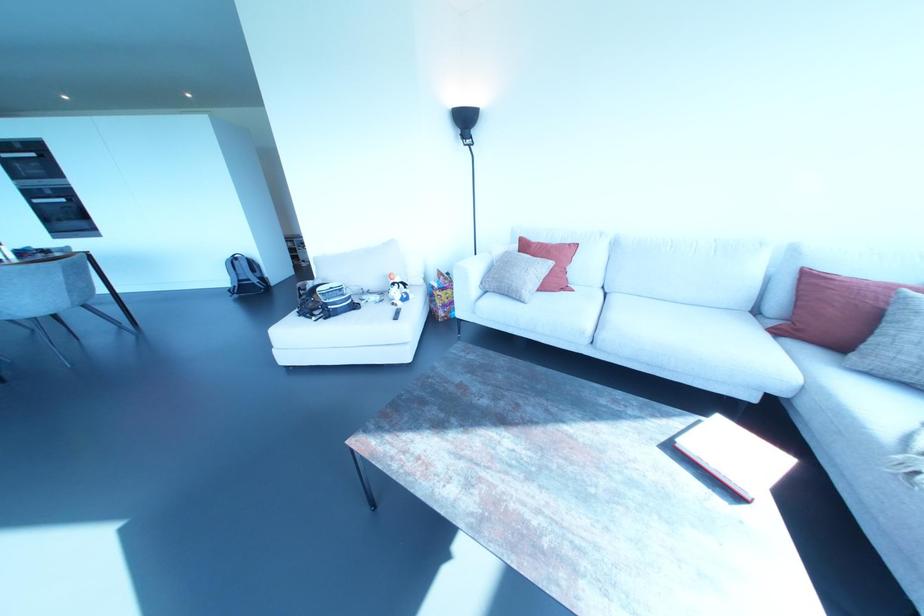
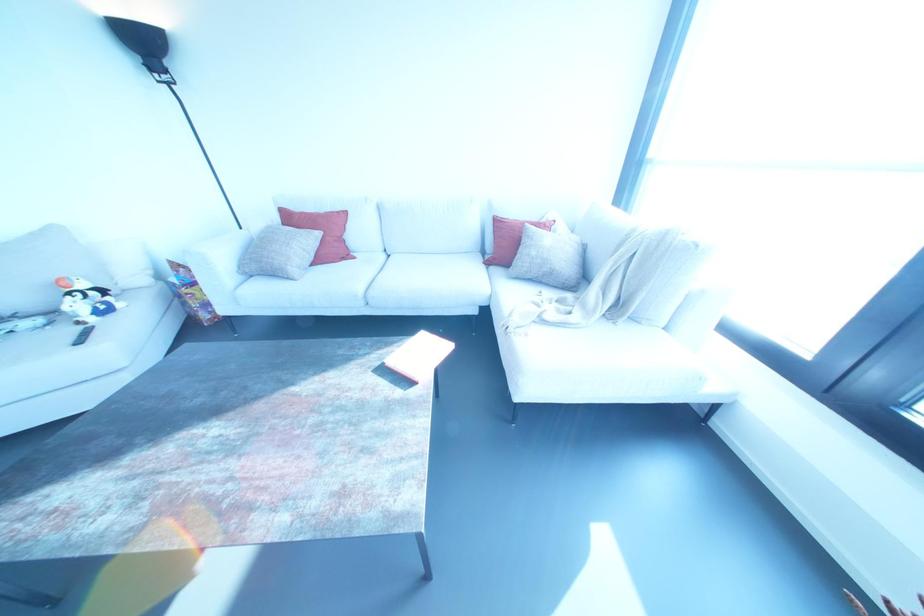
Where in the second image is the point corresponding to point 524,245 from the first image?

(286, 217)